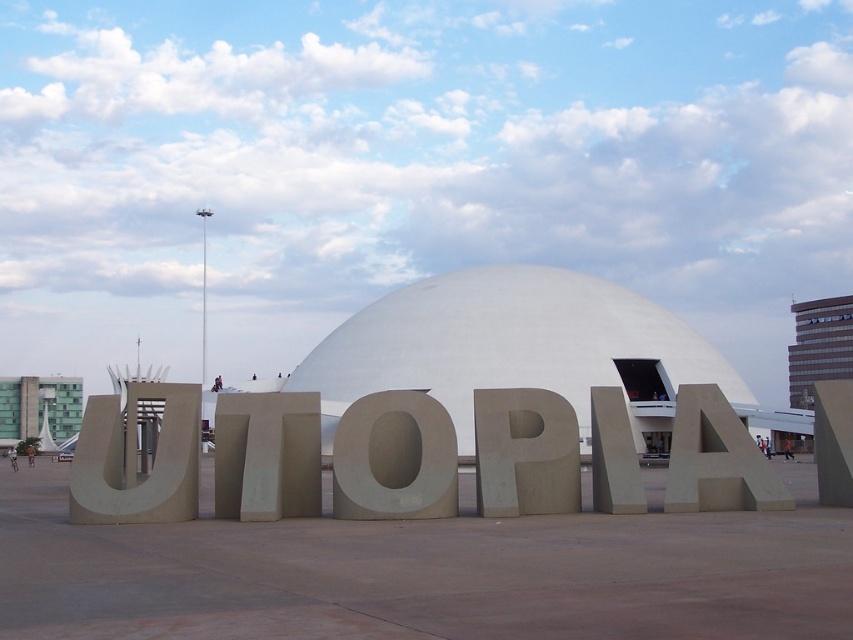
Consider the image. You are standing in the plaza and see the two central letters, the matte gray letter p at center and the gray concrete letter at center. Which one is positioned to the left?

The matte gray letter p at center is positioned to the left of the gray concrete letter at center.

You are standing in the plaza and want to take a photo of the matte concrete letter a at center without the white smooth dome at center blocking the view. Is this possible?

The matte concrete letter a at center is behind the white smooth dome at center, so it is blocked by the dome. Therefore, you cannot take a photo of the matte concrete letter a at center without the white smooth dome at center blocking the view.

You are an architect evaluating the plaza design. You need to determine if the white smooth dome at center will block the view of the matte gray letter p at center from a visitor standing at the plaza entrance. Based on their sizes, can the dome potentially obscure the letter?

The white smooth dome at center is bigger than the matte gray letter p at center, so it could potentially block the view of the matte gray letter p at center if positioned between the visitor and the letter.